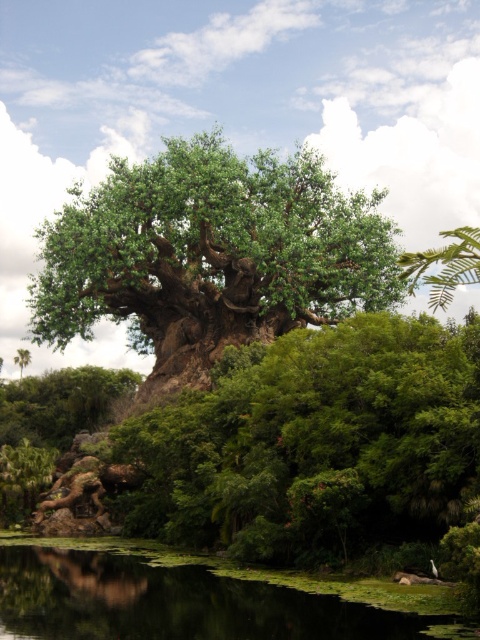
Question: Observing the image, what is the correct spatial positioning of green rough bark tree at center in reference to green leafy tree at center?

Choices:
 (A) below
 (B) above

Answer: (B)

Question: Which object appears closest to the camera in this image?

Choices:
 (A) green rough bark tree at center
 (B) green leafy tree at center

Answer: (A)

Question: Estimate the real-world distances between objects in this image. Which object is farther from the green leafy tree at center?

Choices:
 (A) green leafy tree at upper right
 (B) green algae water at lower center
 (C) green rough bark tree at center

Answer: (B)

Question: Can you confirm if green leafy tree at upper right is smaller than green leafy tree at center?

Choices:
 (A) no
 (B) yes

Answer: (A)

Question: Can you confirm if green rough bark tree at center is wider than green algae water at lower center?

Choices:
 (A) yes
 (B) no

Answer: (A)

Question: Which object is farther from the camera taking this photo?

Choices:
 (A) green rough bark tree at center
 (B) green algae water at lower center
 (C) green leafy tree at upper right
 (D) green leafy tree at center

Answer: (D)